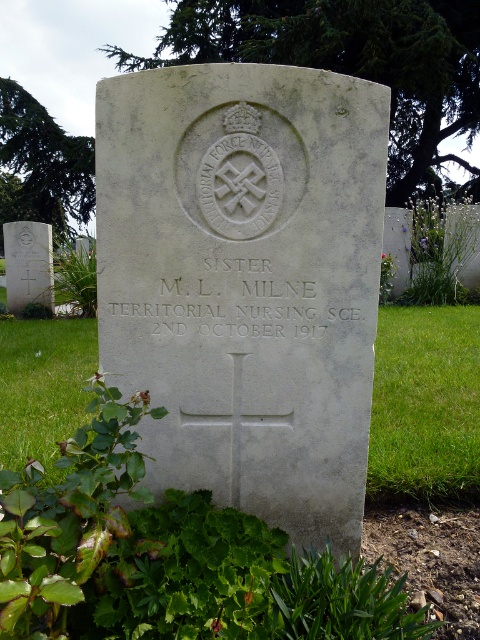
You are standing at the point with coordinates closest to the gravestone. You notice two points marked on the gravestone. Which point is closer to you, point at coordinates (467, 440) or point at coordinates (439, 342)?

Point at coordinates (467, 440) is in front of point at coordinates (439, 342), so it is closer to you.

Looking at this image, you are standing in a cemetery and see the gray stone cross at center and the green grass at lower right. Which object is positioned to the right side of the other?

The gray stone cross at center is to the left of green grass at lower right, so the green grass at lower right is positioned to the right side of the gray stone cross at center.